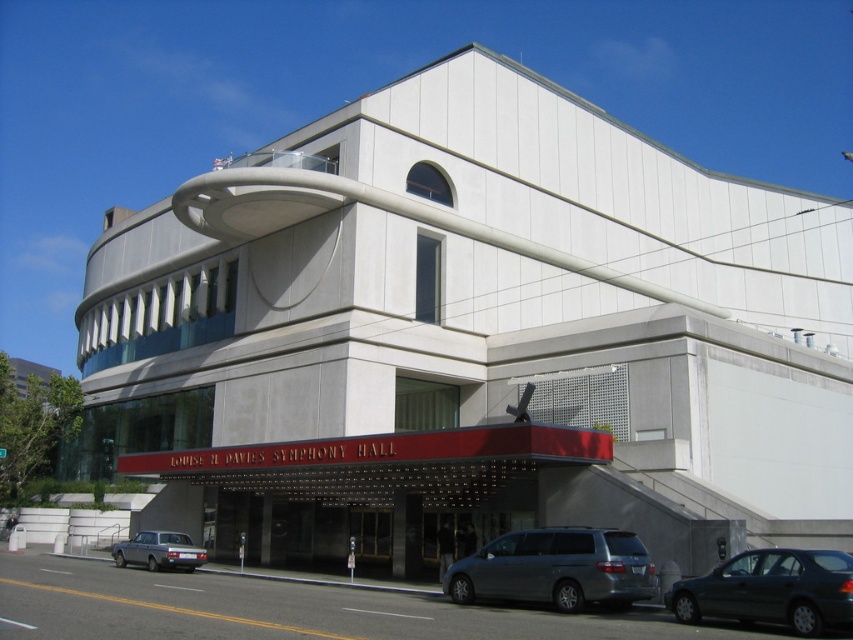
You are a visitor arriving at the Louise M. Davies Symphony Hall and see a silver metallic minivan at lower center and a silver metallic station wagon at lower left parked nearby. Which vehicle should you avoid parking next to if you want to leave first?

You should avoid parking next to the silver metallic station wagon at lower left because it is larger than the silver metallic minivan at lower center, making it harder to maneuver around.

You are a visitor arriving at the Louise M. Davies Symphony Hall and need to park your car. You see a silver metallic minivan at lower center and a dark gray metallic sedan at lower right. Which vehicle is closer to the entrance of the symphony hall?

The silver metallic minivan at lower center is closer to the entrance of the Louise M. Davies Symphony Hall because it is positioned further to the viewer than the dark gray metallic sedan at lower right.

You are a parking attendant at the Louise M. Davies Symphony Hall. You need to guide a driver to park their car between the silver metallic minivan at lower center and the dark gray metallic sedan at lower right. The driver has a car that is 2.5 meters long. Is there enough space between the two vehicles for the driver to park?

The silver metallic minivan at lower center is 5.20 meters from the dark gray metallic sedan at lower right. Since the driver needs only 2.5 meters of space, there is sufficient room to park between them.